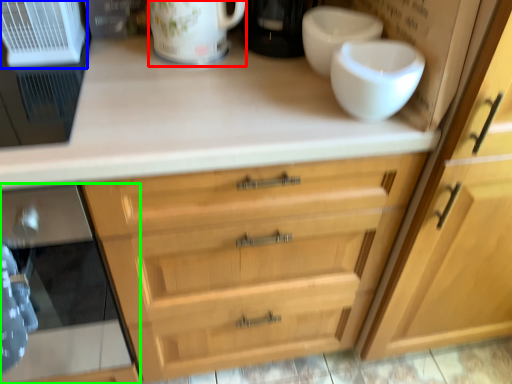
Question: Which is nearer to the mug (highlighted by a red box)? appliance (highlighted by a blue box) or oven (highlighted by a green box).

Choices:
 (A) appliance
 (B) oven

Answer: (A)